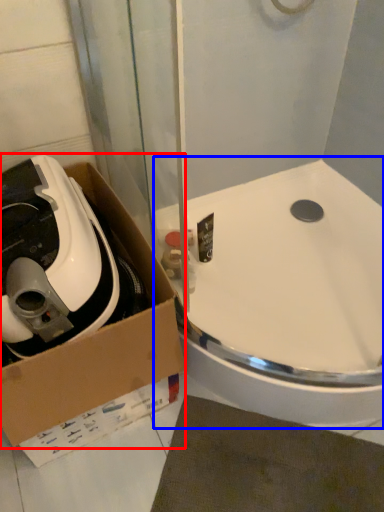
Question: Which point is further to the camera, box (highlighted by a red box) or sink (highlighted by a blue box)?

Choices:
 (A) box
 (B) sink

Answer: (B)